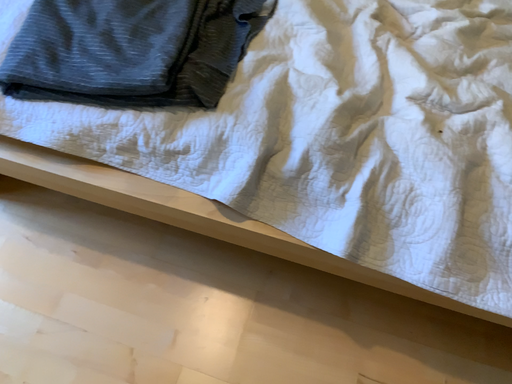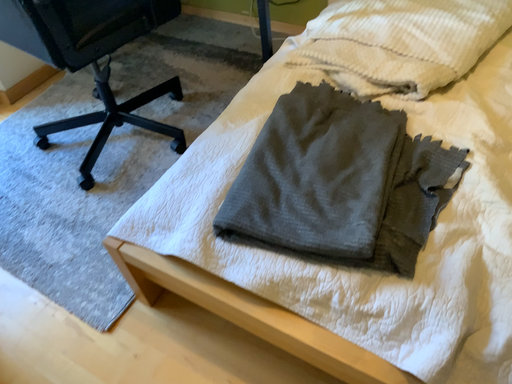
Question: Which way did the camera rotate in the video?

Choices:
 (A) rotated downward
 (B) rotated upward

Answer: (B)